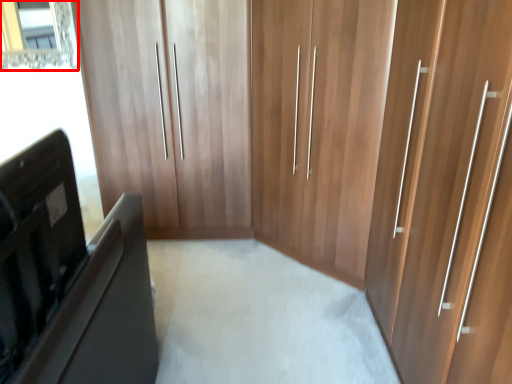
Question: From the image's perspective, what is the correct spatial relationship of mirror (annotated by the red box) in relation to furniture?

Choices:
 (A) below
 (B) above

Answer: (B)